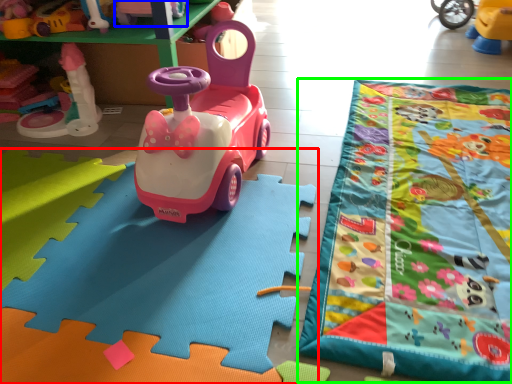
Question: Estimate the real-world distances between objects in this image. Which object is farther from toy (highlighted by a red box), toy (highlighted by a blue box) or blanket (highlighted by a green box)?

Choices:
 (A) toy
 (B) blanket

Answer: (A)